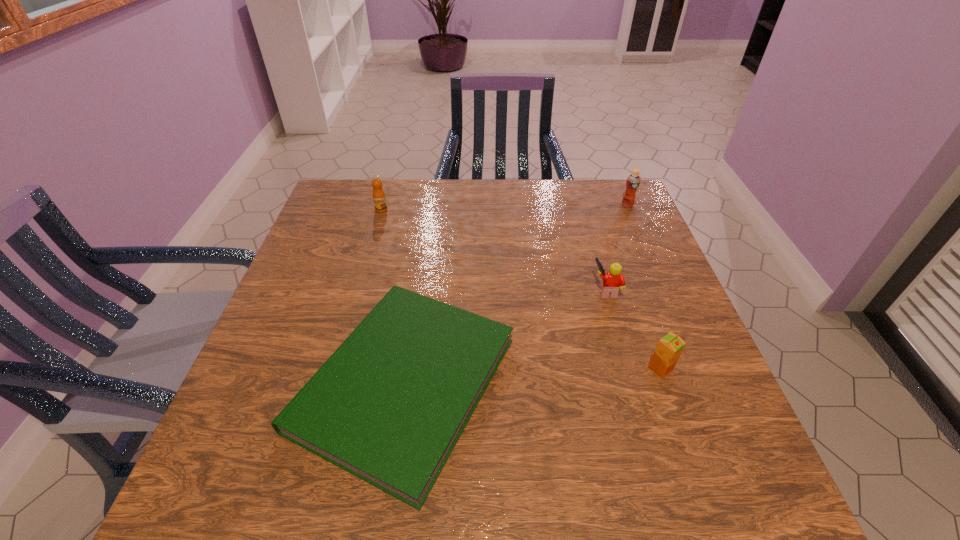
Find the location of `vacant space that satisfies the following two spatial constraints: 1. on the front label of the paperback book; 2. on the left side of the leftmost orange juice`. vacant space that satisfies the following two spatial constraints: 1. on the front label of the paperback book; 2. on the left side of the leftmost orange juice is located at coordinates (332, 383).

I want to click on vacant space that satisfies the following two spatial constraints: 1. in front of the third object from right to left with the accessory visible; 2. on the back side of the second object from right to left, so click(x=630, y=369).